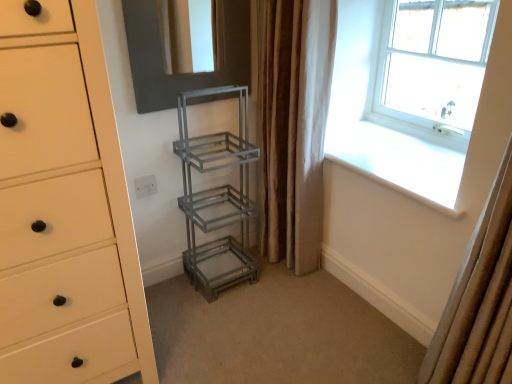
Question: From a real-world perspective, does clear glass window at upper right sit lower than matte white chest of drawers at left?

Choices:
 (A) yes
 (B) no

Answer: (B)

Question: Would you say clear glass window at upper right contains matte white chest of drawers at left?

Choices:
 (A) no
 (B) yes

Answer: (A)

Question: From the image's perspective, is clear glass window at upper right over matte white chest of drawers at left?

Choices:
 (A) no
 (B) yes

Answer: (B)

Question: Is clear glass window at upper right aimed at matte white chest of drawers at left?

Choices:
 (A) no
 (B) yes

Answer: (B)

Question: Does clear glass window at upper right have a greater height compared to matte white chest of drawers at left?

Choices:
 (A) yes
 (B) no

Answer: (B)

Question: Looking at the image, does matte black mirror at upper center seem bigger or smaller compared to beige fabric curtain at right, positioned as the first curtain in front-to-back order?

Choices:
 (A) big
 (B) small

Answer: (B)

Question: Considering the positions of matte black mirror at upper center and beige fabric curtain at right, the 2th curtain positioned from the left, in the image, is matte black mirror at upper center taller or shorter than beige fabric curtain at right, the 2th curtain positioned from the left,?

Choices:
 (A) tall
 (B) short

Answer: (B)

Question: Does point (159, 38) appear closer or farther from the camera than point (497, 183)?

Choices:
 (A) farther
 (B) closer

Answer: (A)

Question: From the image's perspective, is matte black mirror at upper center located above or below beige fabric curtain at right, positioned as the first curtain in front-to-back order?

Choices:
 (A) below
 (B) above

Answer: (B)

Question: Is matte black mirror at upper center taller or shorter than clear glass window at upper right?

Choices:
 (A) tall
 (B) short

Answer: (B)

Question: Is point (231, 41) positioned closer to the camera than point (428, 110)?

Choices:
 (A) farther
 (B) closer

Answer: (B)

Question: From the image's perspective, is matte black mirror at upper center positioned above or below clear glass window at upper right?

Choices:
 (A) below
 (B) above

Answer: (B)

Question: From a real-world perspective, is matte black mirror at upper center positioned above or below clear glass window at upper right?

Choices:
 (A) above
 (B) below

Answer: (A)

Question: Is brown textured curtain at right, the 1th curtain viewed from the left, wider or thinner than beige fabric curtain at right, the 2th curtain positioned from the left?

Choices:
 (A) wide
 (B) thin

Answer: (B)

Question: Considering the positions of brown textured curtain at right, marked as the 2th curtain in a right-to-left arrangement, and beige fabric curtain at right, which is the 2th curtain from back to front, in the image, is brown textured curtain at right, marked as the 2th curtain in a right-to-left arrangement, bigger or smaller than beige fabric curtain at right, which is the 2th curtain from back to front,?

Choices:
 (A) small
 (B) big

Answer: (B)